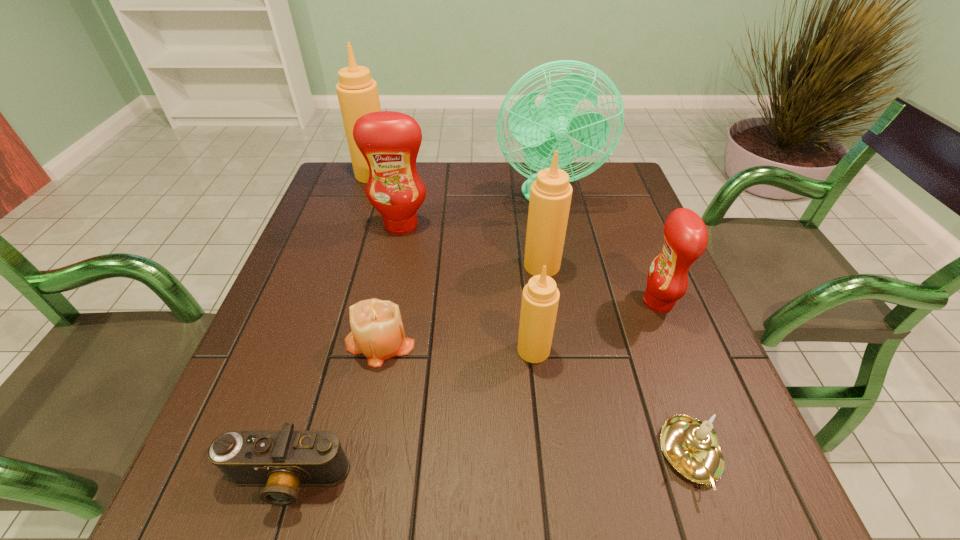
The image size is (960, 540). I want to click on the right red condiment, so (685, 234).

Find the location of a particular element. This screenshot has width=960, height=540. candle is located at coordinates (377, 332).

Locate an element on the screen. candle holder is located at coordinates (691, 446).

This screenshot has width=960, height=540. Find the location of `camera`. camera is located at coordinates (282, 460).

Locate an element on the screen. Image resolution: width=960 pixels, height=540 pixels. free space located 0.130m in front of the blue fan to blow air is located at coordinates (558, 247).

At what (x,y) coordinates should I click in order to perform the action: click on vacant space positioned 0.060m on the left of the tallest condiment. Please return your answer as a coordinate pair (x, y). Image resolution: width=960 pixels, height=540 pixels. Looking at the image, I should click on (336, 174).

Where is `vacant space located 0.050m on the label side of the second farthest condiment`? vacant space located 0.050m on the label side of the second farthest condiment is located at coordinates coord(396,249).

Locate an element on the screen. The height and width of the screenshot is (540, 960). free space located on the back of the third farthest condiment is located at coordinates (535, 219).

At what (x,y) coordinates should I click in order to perform the action: click on vacant space located 0.110m on the left of the nearest tan condiment. Please return your answer as a coordinate pair (x, y). The image size is (960, 540). Looking at the image, I should click on pos(462,350).

Where is `free point located on the label side of the rightmost condiment`? Image resolution: width=960 pixels, height=540 pixels. free point located on the label side of the rightmost condiment is located at coordinates (596, 302).